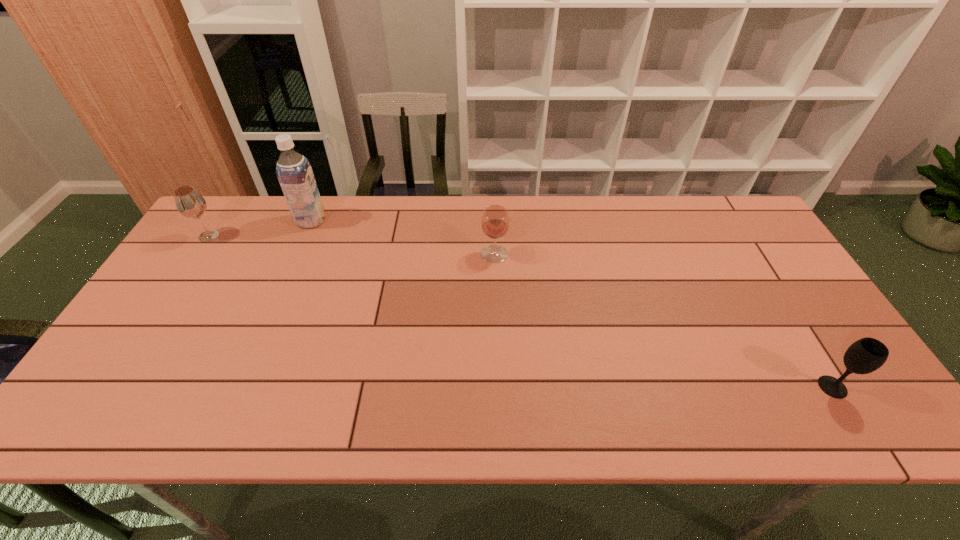
Find the location of `free space that satisfies the following two spatial constraints: 1. on the label of the soya milk; 2. on the right side of the nearest wineglass`. free space that satisfies the following two spatial constraints: 1. on the label of the soya milk; 2. on the right side of the nearest wineglass is located at coordinates (241, 387).

Where is `free space that satisfies the following two spatial constraints: 1. on the front side of the rightmost wineglass; 2. on the right side of the leftmost wineglass`? The height and width of the screenshot is (540, 960). free space that satisfies the following two spatial constraints: 1. on the front side of the rightmost wineglass; 2. on the right side of the leftmost wineglass is located at coordinates (110, 387).

This screenshot has width=960, height=540. What are the coordinates of `vacant region that satisfies the following two spatial constraints: 1. on the label of the tallest object; 2. on the left side of the nearest object` in the screenshot? It's located at (241, 387).

The height and width of the screenshot is (540, 960). In order to click on free location that satisfies the following two spatial constraints: 1. on the label of the third object from left to right; 2. on the right side of the tallest object in this screenshot , I will do `click(297, 254)`.

You are a GUI agent. You are given a task and a screenshot of the screen. Output one action in this format:
    pyautogui.click(x=<x>, y=<y>)
    Task: Click on the vacant region that satisfies the following two spatial constraints: 1. on the label of the second nearest object; 2. on the left side of the tallest object
    The height and width of the screenshot is (540, 960).
    Given the screenshot: What is the action you would take?
    pyautogui.click(x=297, y=254)

Where is `free space that satisfies the following two spatial constraints: 1. on the back side of the rightmost wineglass; 2. on the label of the tallest object`? free space that satisfies the following two spatial constraints: 1. on the back side of the rightmost wineglass; 2. on the label of the tallest object is located at coordinates click(730, 221).